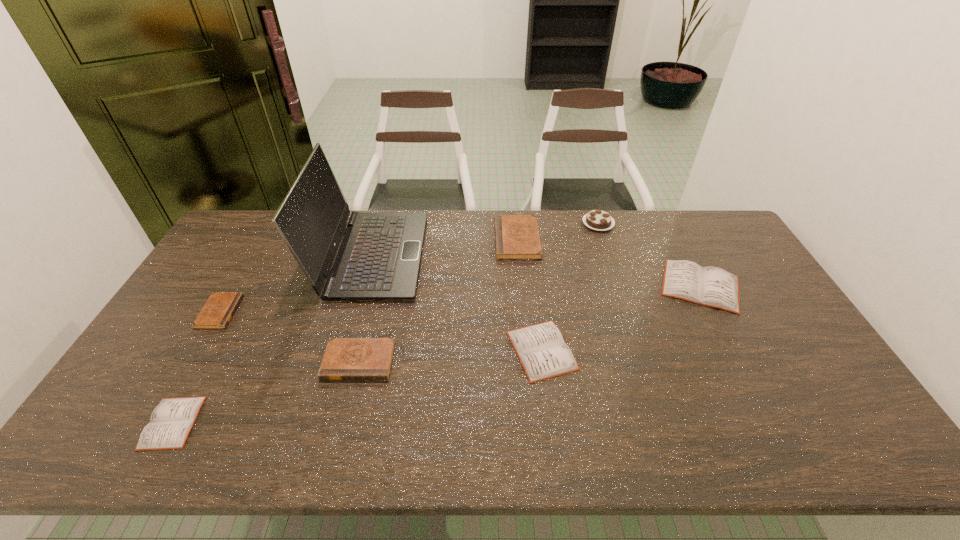
Identify the location of vacant space located 0.100m on the spine side of the biggest brown diary. (467, 239).

Find the location of a particular element. This screenshot has height=540, width=960. vacant space located on the front of the farthest white diary is located at coordinates (751, 381).

The width and height of the screenshot is (960, 540). In order to click on vacant area situated on the spine side of the second smallest brown diary in this screenshot , I will do `click(342, 431)`.

The height and width of the screenshot is (540, 960). I want to click on vacant space situated on the left of the second nearest white diary, so click(x=486, y=350).

The width and height of the screenshot is (960, 540). I want to click on vacant space located 0.270m on the spine side of the leftmost brown diary, so click(x=326, y=312).

At what (x,y) coordinates should I click in order to perform the action: click on free space located on the back of the nearest white diary. Please return your answer as a coordinate pair (x, y). The width and height of the screenshot is (960, 540). Looking at the image, I should click on (248, 286).

This screenshot has height=540, width=960. Identify the location of laptop computer present at the far edge. tap(378, 259).

In order to click on chocolate cake present at the far edge in this screenshot , I will do `click(600, 220)`.

At what (x,y) coordinates should I click in order to perform the action: click on diary at the far edge. Please return your answer as a coordinate pair (x, y). The image size is (960, 540). Looking at the image, I should click on (517, 237).

At what (x,y) coordinates should I click in order to perform the action: click on object located at the near edge. Please return your answer as a coordinate pair (x, y). Looking at the image, I should click on (171, 421).